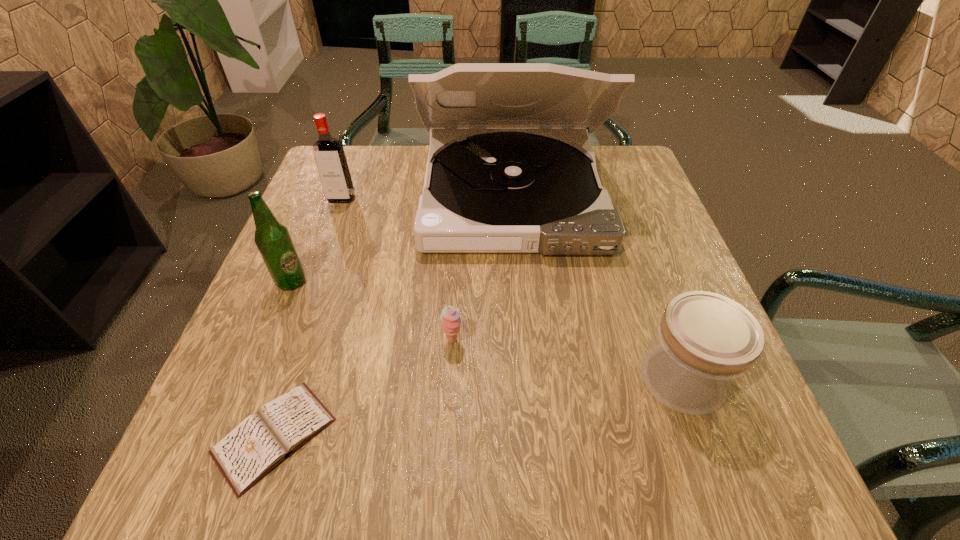
Locate an element on the screen. The width and height of the screenshot is (960, 540). vacant space that satisfies the following two spatial constraints: 1. on the front and back of the second shortest object; 2. on the right side of the vodka is located at coordinates (290, 341).

Locate an element on the screen. The image size is (960, 540). free space in the image that satisfies the following two spatial constraints: 1. on the label of the beer bottle; 2. on the back side of the jar is located at coordinates pyautogui.click(x=252, y=379).

I want to click on vacant space that satisfies the following two spatial constraints: 1. on the label of the diary; 2. on the right side of the beer bottle, so click(228, 436).

Identify the location of free location that satisfies the following two spatial constraints: 1. on the label of the fifth tallest object; 2. on the left side of the beer bottle. Image resolution: width=960 pixels, height=540 pixels. (267, 341).